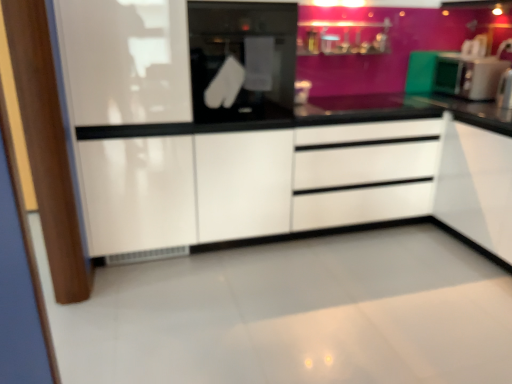
Question: Does black glass oven at center have a greater width compared to white glossy cabinet at center?

Choices:
 (A) yes
 (B) no

Answer: (B)

Question: Is black glass oven at center smaller than white glossy cabinet at center?

Choices:
 (A) yes
 (B) no

Answer: (A)

Question: Is black glass oven at center bigger than white glossy cabinet at center?

Choices:
 (A) yes
 (B) no

Answer: (B)

Question: Considering the relative positions of black glass oven at center and white glossy cabinet at center in the image provided, is black glass oven at center to the left of white glossy cabinet at center from the viewer's perspective?

Choices:
 (A) no
 (B) yes

Answer: (A)

Question: Does black glass oven at center have a lesser width compared to white glossy cabinet at center?

Choices:
 (A) no
 (B) yes

Answer: (B)

Question: Is black glass oven at center taller or shorter than white glossy drawer at center?

Choices:
 (A) tall
 (B) short

Answer: (B)

Question: From the image's perspective, relative to white glossy drawer at center, is black glass oven at center above or below?

Choices:
 (A) above
 (B) below

Answer: (A)

Question: Considering their positions, is black glass oven at center located in front of or behind white glossy drawer at center?

Choices:
 (A) behind
 (B) front

Answer: (B)

Question: Do you think black glass oven at center is within white glossy drawer at center, or outside of it?

Choices:
 (A) inside
 (B) outside

Answer: (B)

Question: From the image's perspective, relative to green matte microwave at right, is black glass oven at center above or below?

Choices:
 (A) below
 (B) above

Answer: (A)

Question: Is black glass oven at center bigger or smaller than green matte microwave at right?

Choices:
 (A) small
 (B) big

Answer: (B)

Question: Relative to green matte microwave at right, is black glass oven at center in front or behind?

Choices:
 (A) behind
 (B) front

Answer: (B)

Question: Does point (290, 81) appear closer or farther from the camera than point (479, 57)?

Choices:
 (A) farther
 (B) closer

Answer: (B)

Question: In terms of height, does black glass oven at center look taller or shorter compared to white glossy cabinet at center?

Choices:
 (A) tall
 (B) short

Answer: (B)

Question: Considering the positions of point pyautogui.click(x=282, y=34) and point pyautogui.click(x=70, y=16), is point pyautogui.click(x=282, y=34) closer or farther from the camera than point pyautogui.click(x=70, y=16)?

Choices:
 (A) farther
 (B) closer

Answer: (A)